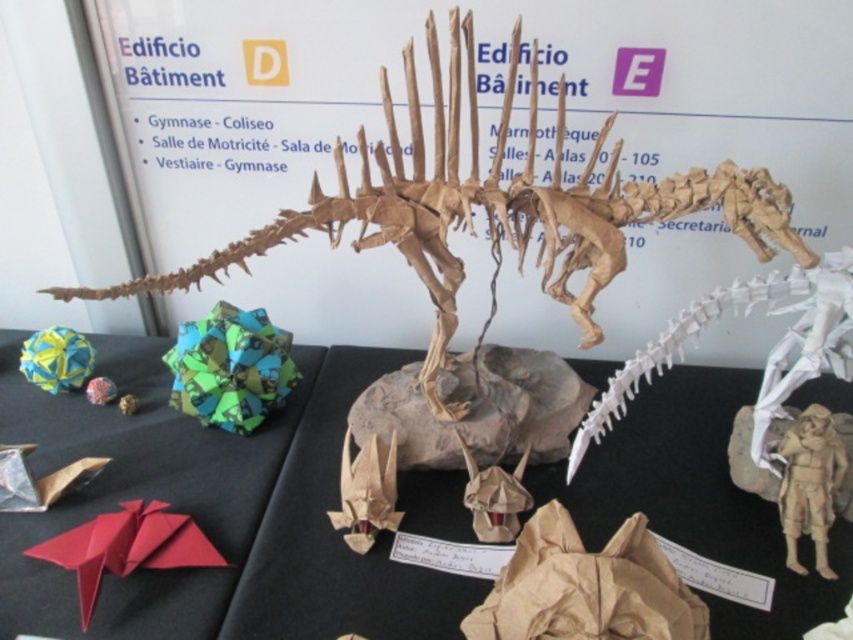
Question: Observing the image, what is the correct spatial positioning of black paper at center in reference to brown paper dinosaur at center?

Choices:
 (A) right
 (B) left

Answer: (B)

Question: Where is black paper at center located in relation to white paper spine at center in the image?

Choices:
 (A) above
 (B) below

Answer: (B)

Question: Which object is farther from the camera taking this photo?

Choices:
 (A) black paper at center
 (B) white paper spine at center
 (C) brown paper dinosaur at center

Answer: (B)

Question: Which is farther from the black paper at center?

Choices:
 (A) brown paper dinosaur at center
 (B) white paper spine at center

Answer: (A)

Question: Is brown paper dinosaur at center to the right of white paper spine at center from the viewer's perspective?

Choices:
 (A) yes
 (B) no

Answer: (B)

Question: Based on their relative distances, which object is farther from the white paper spine at center?

Choices:
 (A) brown paper dinosaur at center
 (B) black paper at center

Answer: (B)